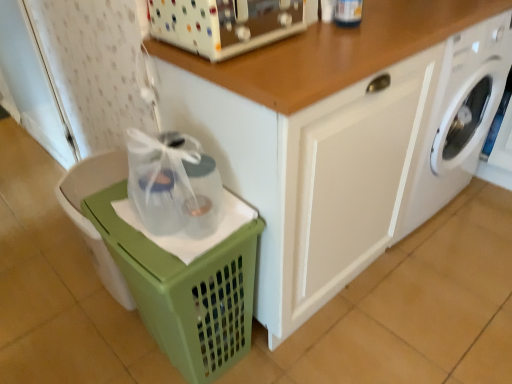
Question: Does white glossy washing machine at lower right have a lesser height compared to white glossy cabinet at center?

Choices:
 (A) no
 (B) yes

Answer: (B)

Question: Can you confirm if white glossy washing machine at lower right is bigger than white glossy cabinet at center?

Choices:
 (A) yes
 (B) no

Answer: (B)

Question: Is white glossy washing machine at lower right next to white glossy cabinet at center?

Choices:
 (A) yes
 (B) no

Answer: (B)

Question: From the image's perspective, would you say white glossy washing machine at lower right is positioned over white glossy cabinet at center?

Choices:
 (A) no
 (B) yes

Answer: (B)

Question: Is white glossy washing machine at lower right not inside white glossy cabinet at center?

Choices:
 (A) no
 (B) yes

Answer: (B)

Question: Is point (480, 105) closer or farther from the camera than point (32, 66)?

Choices:
 (A) farther
 (B) closer

Answer: (B)

Question: Is white glossy washing machine at lower right to the left or to the right of white textured screen door at left in the image?

Choices:
 (A) right
 (B) left

Answer: (A)

Question: Looking at their shapes, would you say white glossy washing machine at lower right is wider or thinner than white textured screen door at left?

Choices:
 (A) thin
 (B) wide

Answer: (B)

Question: Considering their positions, is white glossy washing machine at lower right located in front of or behind white textured screen door at left?

Choices:
 (A) behind
 (B) front

Answer: (B)

Question: From the image's perspective, is green plastic basket at lower left located above or below white plastic toaster at upper center?

Choices:
 (A) below
 (B) above

Answer: (A)

Question: Is green plastic basket at lower left to the left or to the right of white plastic toaster at upper center in the image?

Choices:
 (A) left
 (B) right

Answer: (A)

Question: Would you say green plastic basket at lower left is inside or outside white plastic toaster at upper center?

Choices:
 (A) inside
 (B) outside

Answer: (B)

Question: Is point (62, 190) closer or farther from the camera than point (196, 11)?

Choices:
 (A) farther
 (B) closer

Answer: (A)

Question: Is point (244, 14) closer or farther from the camera than point (241, 248)?

Choices:
 (A) closer
 (B) farther

Answer: (A)

Question: Is white plastic toaster at upper center to the left or to the right of green plastic basket at lower left in the image?

Choices:
 (A) right
 (B) left

Answer: (A)